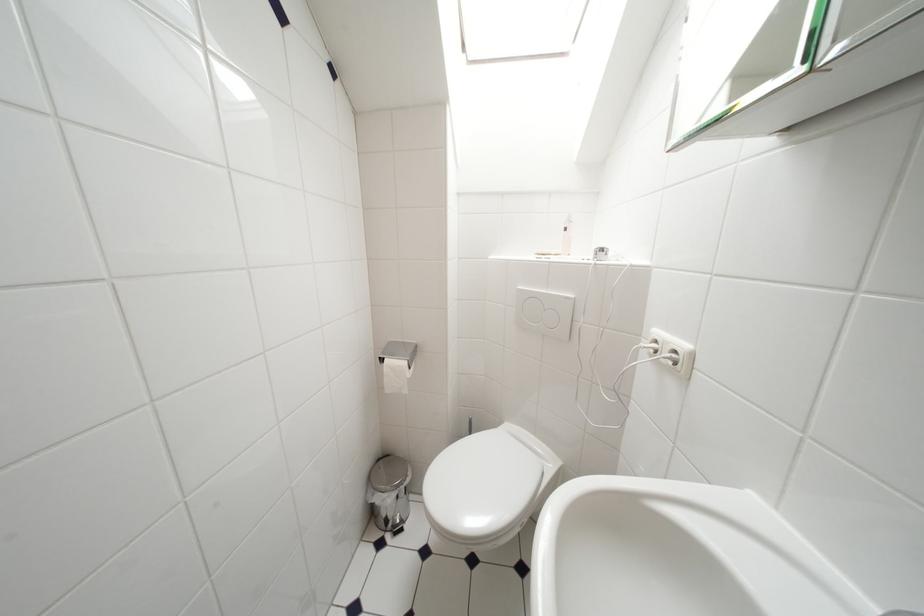
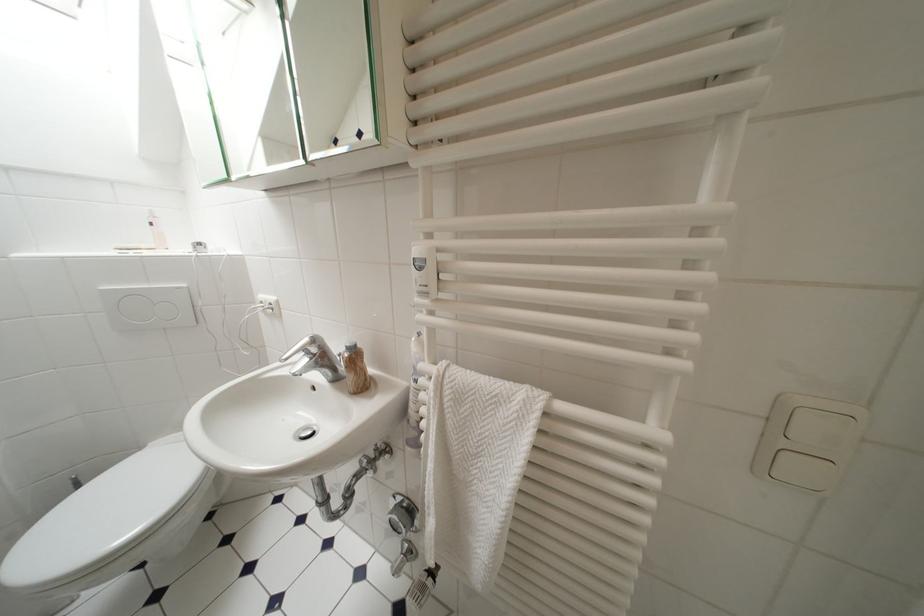
Where in the second image is the point corresponding to point (573, 233) from the first image?

(159, 227)